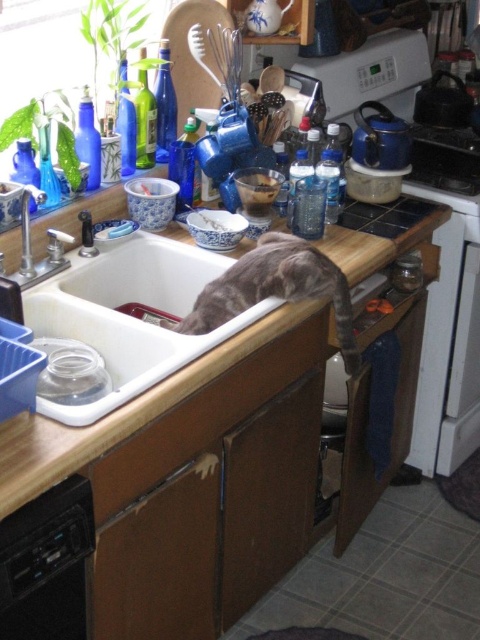
Question: Which point is closer to the camera?

Choices:
 (A) (84, 433)
 (B) (333, 260)

Answer: (A)

Question: Where is wooden at upper center located in relation to brushed metal faucet at sink left in the image?

Choices:
 (A) left
 (B) right

Answer: (B)

Question: Estimate the real-world distances between objects in this image. Which object is farther from the wooden at upper center?

Choices:
 (A) white ceramic sink at center
 (B) brushed metal faucet at sink left

Answer: (B)

Question: Can you confirm if black plastic dishwasher at lower left is wider than brushed metal faucet at sink left?

Choices:
 (A) no
 (B) yes

Answer: (B)

Question: Which point is farther to the camera?

Choices:
 (A) black plastic dishwasher at lower left
 (B) wooden at upper center

Answer: (A)

Question: In this image, where is black plastic dishwasher at lower left located relative to brushed metal faucet at sink left?

Choices:
 (A) left
 (B) right

Answer: (B)